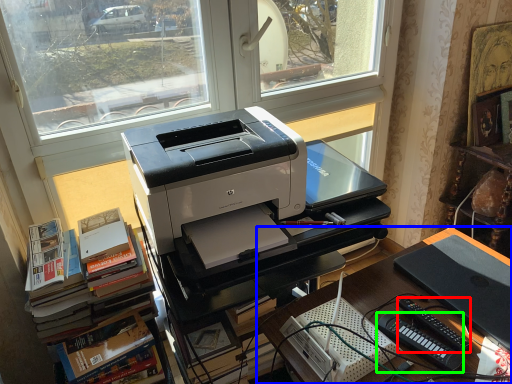
Question: Estimate the real-world distances between objects in this image. Which object is closer to equipment (highlighted by a red box), desk (highlighted by a blue box) or equipment (highlighted by a green box)?

Choices:
 (A) desk
 (B) equipment

Answer: (B)